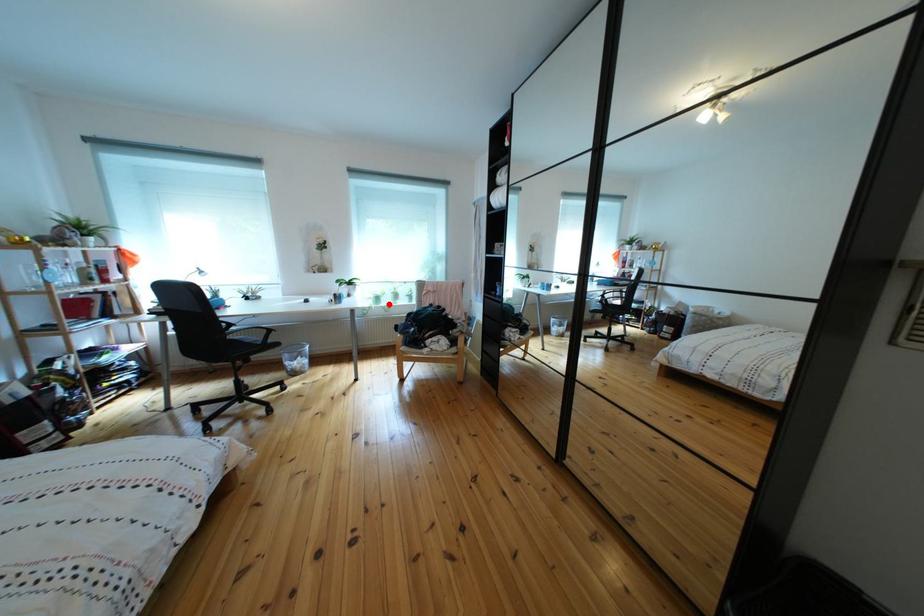
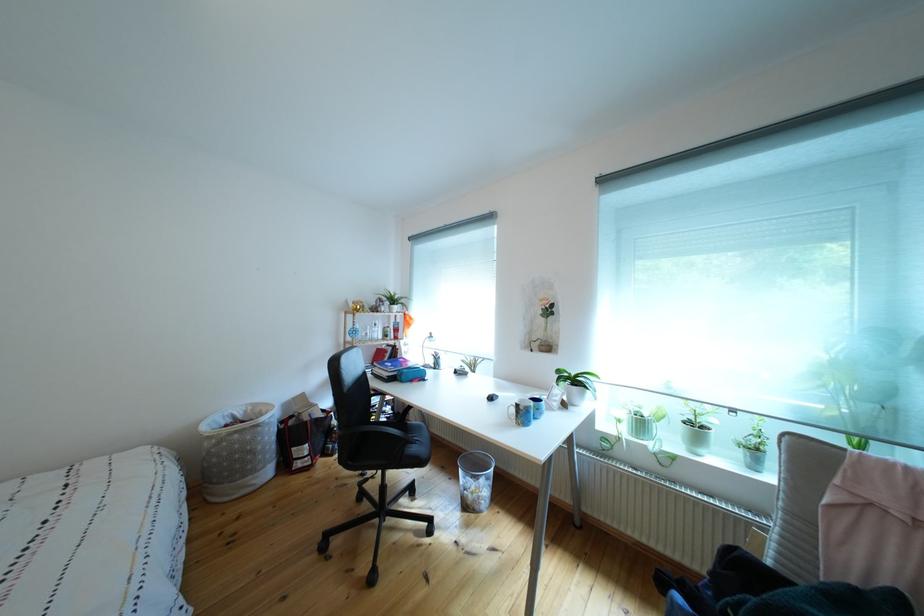
Question: I am providing you with two images of the same scene from different viewpoints. Given a red point in image1, look at the same physical point in image2. Is it:

Choices:
 (A) Closer to the viewpoint
 (B) Farther from the viewpoint

Answer: (B)